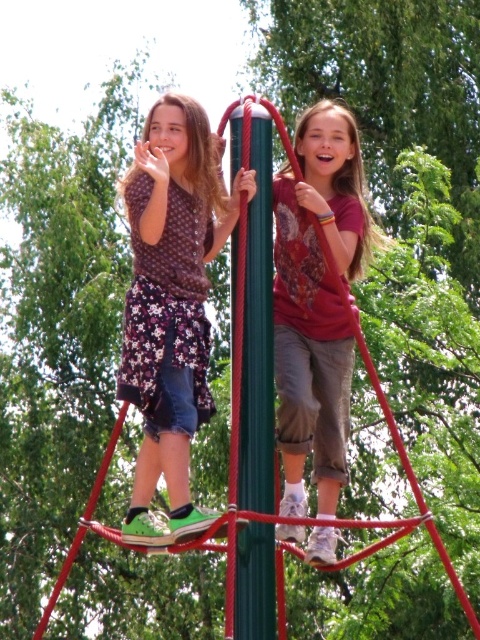
Question: Observing the image, what is the correct spatial positioning of floral fabric skirt at left in reference to matte red shirt at center?

Choices:
 (A) below
 (B) above

Answer: (A)

Question: Is matte red shirt at center to the right of green polished pole at center from the viewer's perspective?

Choices:
 (A) yes
 (B) no

Answer: (A)

Question: Which point is closer to the camera taking this photo?

Choices:
 (A) (313, 449)
 (B) (143, 486)

Answer: (B)

Question: Can you confirm if matte red shirt at center is smaller than green polished pole at center?

Choices:
 (A) no
 (B) yes

Answer: (A)

Question: Which point appears closest to the camera in this image?

Choices:
 (A) (240, 476)
 (B) (192, 397)
 (C) (312, 108)

Answer: (A)

Question: Which of the following is the farthest from the observer?

Choices:
 (A) (x=253, y=353)
 (B) (x=288, y=220)
 (C) (x=159, y=160)

Answer: (B)